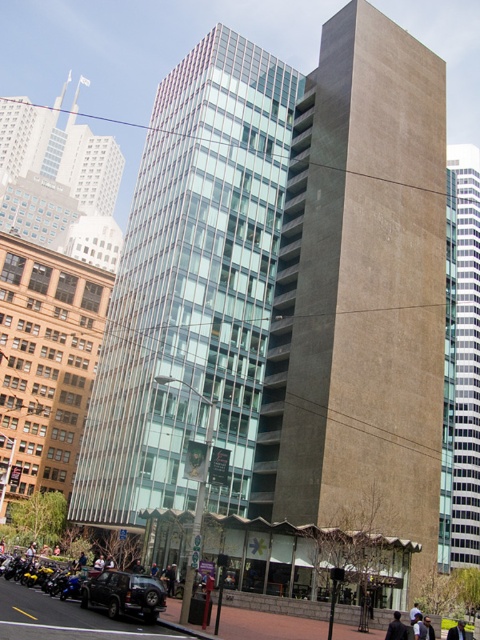
The height and width of the screenshot is (640, 480). I want to click on smooth glass tower at right, so click(x=466, y=360).

Can you confirm if smooth glass tower at right is taller than dark gray jacket at center?

Yes.

In order to click on smooth glass tower at right in this screenshot , I will do (x=466, y=360).

Is dark blue jacket at lower center wider than dark gray jacket at center?

Correct, the width of dark blue jacket at lower center exceeds that of dark gray jacket at center.

Between point (400, 625) and point (425, 627), which one is positioned behind?

The point (425, 627) is more distant.

This screenshot has width=480, height=640. I want to click on dark blue jacket at lower center, so click(x=396, y=628).

Does point (220, 250) come closer to viewer compared to point (420, 618)?

No, (220, 250) is behind (420, 618).

Does glassy steel building at center appear over dark gray jacket at center?

Indeed, glassy steel building at center is positioned over dark gray jacket at center.

Between point (271, 301) and point (428, 637), which one is positioned in front?

Point (428, 637) is more forward.

Where is `glassy steel building at center`? The width and height of the screenshot is (480, 640). glassy steel building at center is located at coordinates (192, 284).